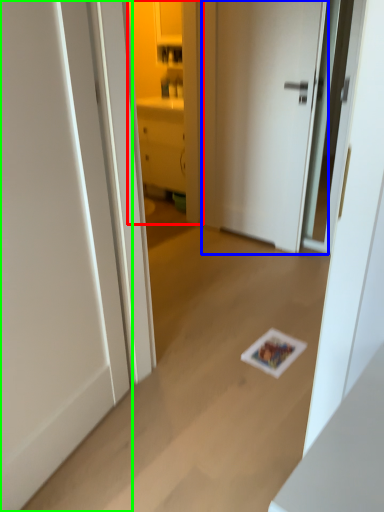
Question: Which object is positioned closest to cabinetry (highlighted by a red box)? Select from door (highlighted by a blue box) and door (highlighted by a green box).

Choices:
 (A) door
 (B) door

Answer: (A)